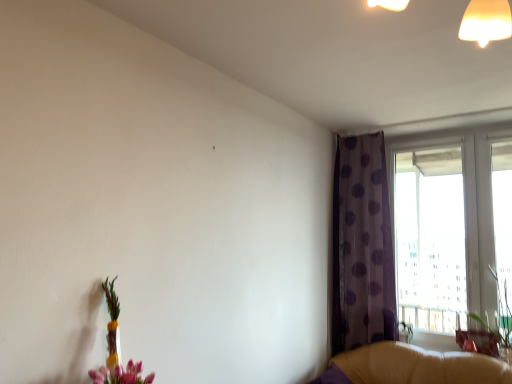
Question: Can you confirm if matte brown swivel chair at lower right is shorter than transparent glass window at right?

Choices:
 (A) no
 (B) yes

Answer: (B)

Question: Can you confirm if matte brown swivel chair at lower right is bigger than transparent glass window at right?

Choices:
 (A) no
 (B) yes

Answer: (A)

Question: Is matte brown swivel chair at lower right beside transparent glass window at right?

Choices:
 (A) no
 (B) yes

Answer: (A)

Question: Is matte brown swivel chair at lower right thinner than transparent glass window at right?

Choices:
 (A) no
 (B) yes

Answer: (B)

Question: Considering the relative positions of matte brown swivel chair at lower right and transparent glass window at right in the image provided, is matte brown swivel chair at lower right behind transparent glass window at right?

Choices:
 (A) no
 (B) yes

Answer: (B)

Question: Is point (348, 226) closer or farther from the camera than point (456, 370)?

Choices:
 (A) closer
 (B) farther

Answer: (B)

Question: Looking at their shapes, would you say purple dotted fabric at upper right is wider or thinner than leather couch at lower right?

Choices:
 (A) thin
 (B) wide

Answer: (A)

Question: From their relative heights in the image, would you say purple dotted fabric at upper right is taller or shorter than leather couch at lower right?

Choices:
 (A) short
 (B) tall

Answer: (B)

Question: Is purple dotted fabric at upper right to the left or to the right of leather couch at lower right in the image?

Choices:
 (A) left
 (B) right

Answer: (A)

Question: Is leather couch at lower right situated inside green leafy plant at right or outside?

Choices:
 (A) inside
 (B) outside

Answer: (B)

Question: Is leather couch at lower right taller or shorter than green leafy plant at right?

Choices:
 (A) tall
 (B) short

Answer: (B)

Question: Considering the positions of leather couch at lower right and green leafy plant at right in the image, is leather couch at lower right wider or thinner than green leafy plant at right?

Choices:
 (A) thin
 (B) wide

Answer: (B)

Question: Based on their positions, is leather couch at lower right located to the left or right of green leafy plant at right?

Choices:
 (A) right
 (B) left

Answer: (B)

Question: From the image's perspective, is purple dotted fabric at upper right positioned above or below translucent glass vase at lower left?

Choices:
 (A) above
 (B) below

Answer: (A)

Question: In the image, is purple dotted fabric at upper right positioned in front of or behind translucent glass vase at lower left?

Choices:
 (A) front
 (B) behind

Answer: (B)